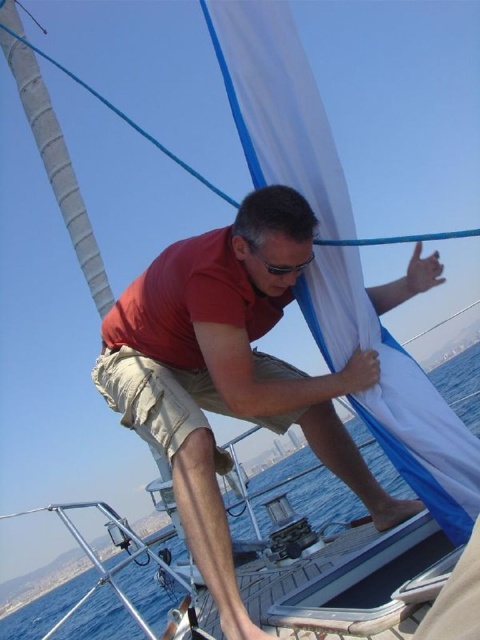
Which is in front, point (230, 378) or point (278, 275)?

Point (278, 275) is in front.

Which is more to the left, red matte shirt at center or black plastic goggles at center?

From the viewer's perspective, red matte shirt at center appears more on the left side.

Is point (342, 426) closer to viewer compared to point (300, 262)?

No, (342, 426) is further to viewer.

Find the location of `red matte shirt at center`. red matte shirt at center is located at coordinates (228, 376).